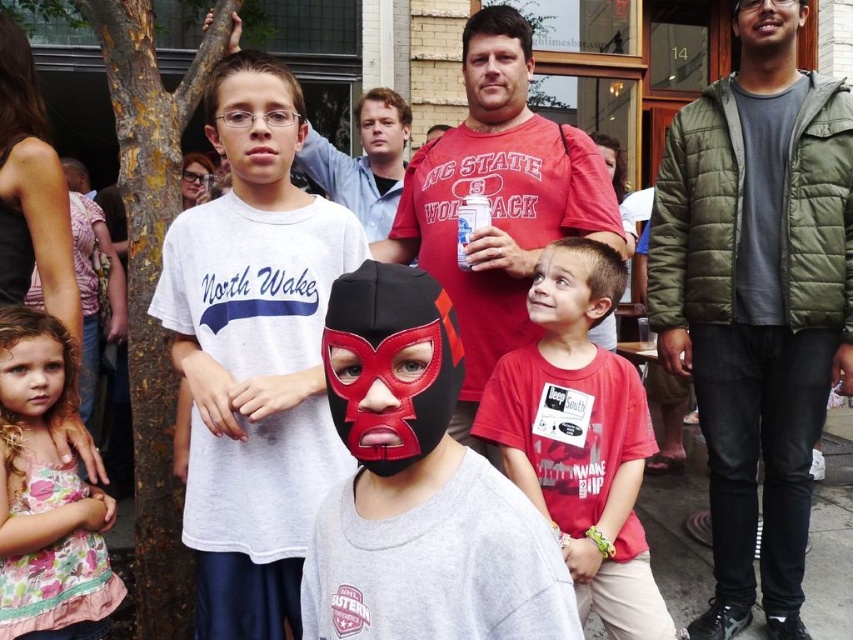
Question: Is olive green puffer jacket at right smaller than floral fabric dress at lower left?

Choices:
 (A) no
 (B) yes

Answer: (A)

Question: Is white cotton t-shirt at center in front of red matte shirt at center?

Choices:
 (A) yes
 (B) no

Answer: (A)

Question: Considering the relative positions of olive green puffer jacket at right and matte red shirt at center in the image provided, where is olive green puffer jacket at right located with respect to matte red shirt at center?

Choices:
 (A) right
 (B) left

Answer: (A)

Question: Which point is closer to the camera taking this photo?

Choices:
 (A) (x=184, y=538)
 (B) (x=444, y=221)

Answer: (A)

Question: Estimate the real-world distances between objects in this image. Which object is farther from the matte red shirt at center?

Choices:
 (A) floral fabric dress at lower left
 (B) matte black mask at center
 (C) olive green puffer jacket at right

Answer: (A)

Question: Which of the following is the farthest from the observer?

Choices:
 (A) red matte shirt at center
 (B) matte black mask at center
 (C) matte red shirt at center

Answer: (C)